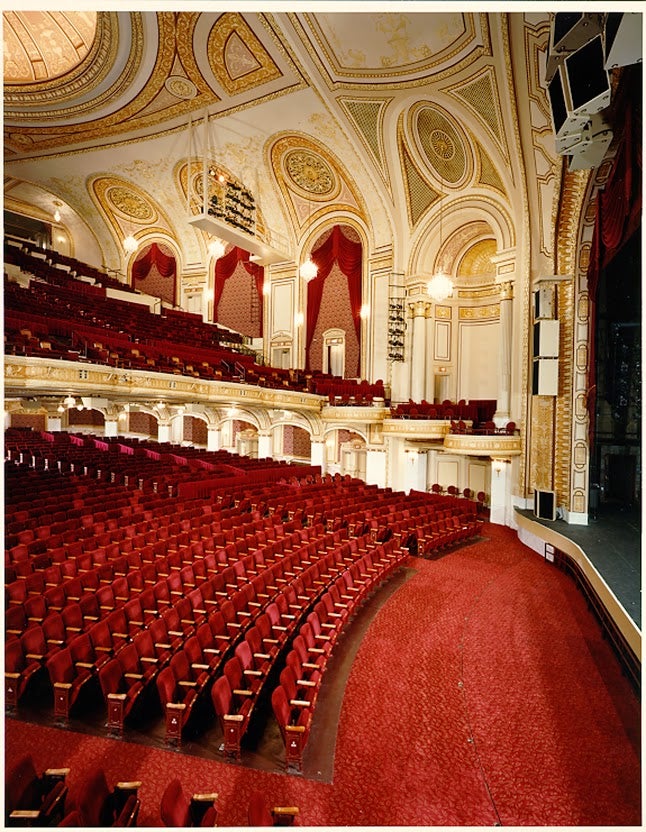
Find the location of a particular element. chandalers is located at coordinates (441, 275), (313, 268), (207, 245), (121, 238), (56, 214).